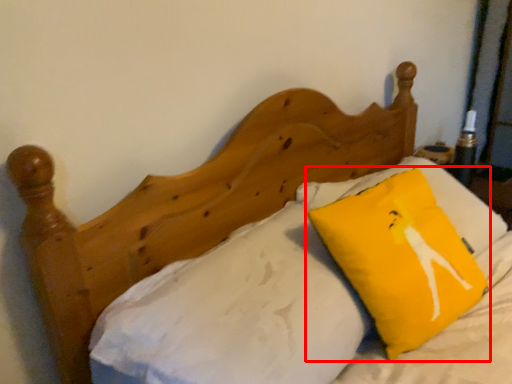
Question: Observing the image, what is the correct spatial positioning of pillow (annotated by the red box) in reference to sheet?

Choices:
 (A) right
 (B) left

Answer: (A)